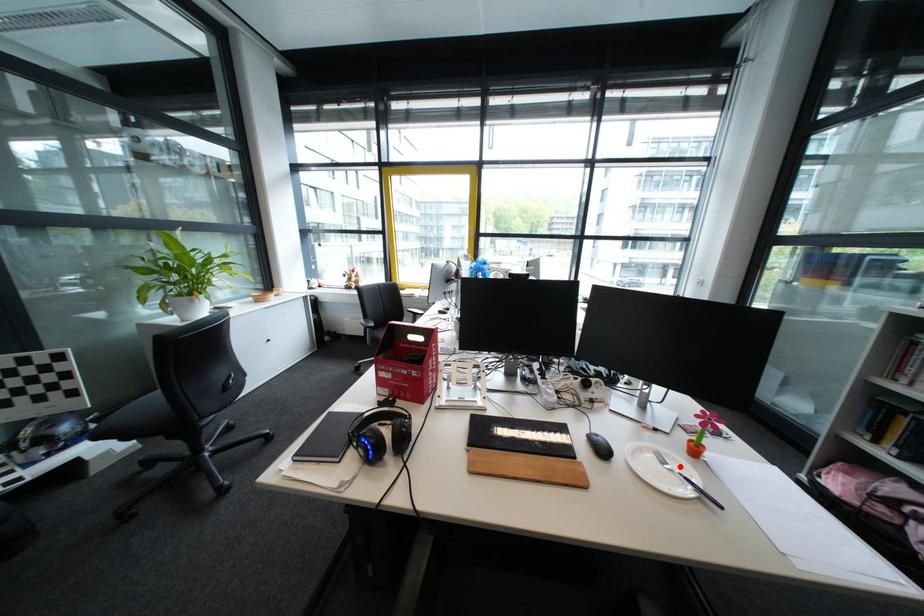
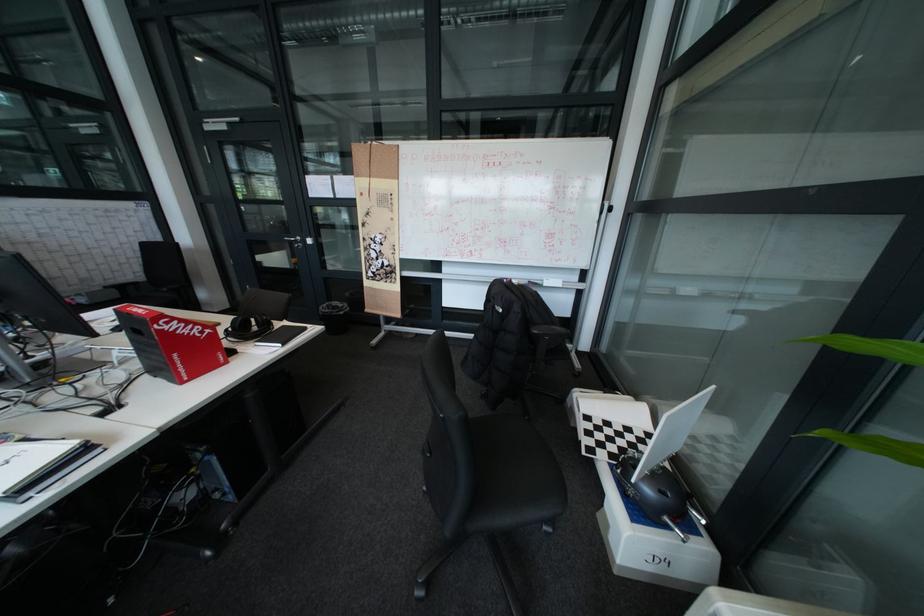
Question: I am providing you with two images of the same scene from different viewpoints. A red point is marked on the first image. Is the red point's position out of view in image 2?

Choices:
 (A) Yes
 (B) No

Answer: (A)